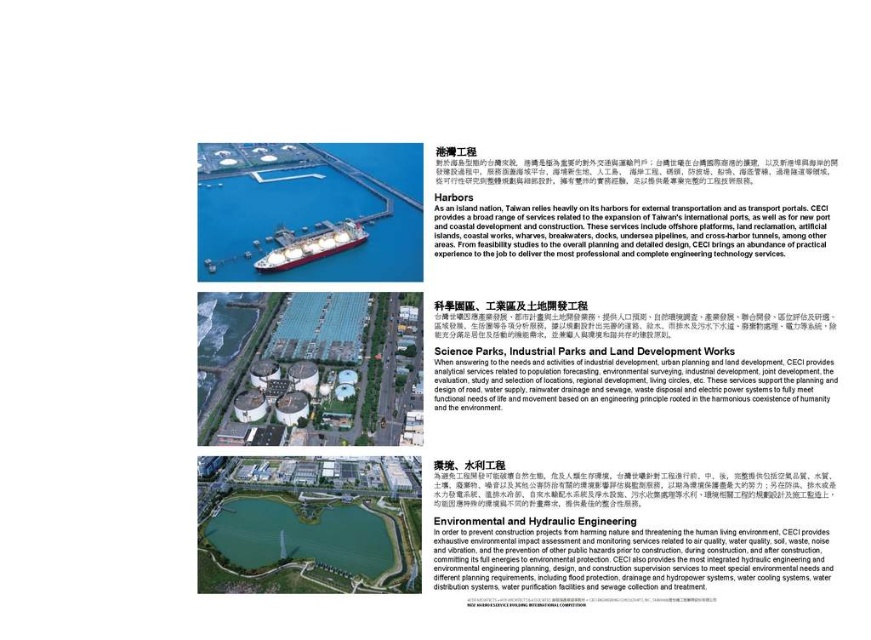
You are an engineer reviewing a project proposal. You see the white paper at center and the red glossy ship at center in the image. Which object is closer to you?

The white paper at center is closer to you because it is in front of the red glossy ship at center.

You are an engineer reviewing a document. The document has two elements on it, the white paper at center and the blue water at lower center. Which element takes up more area on the document?

The blue water at lower center takes up more area on the document because the white paper at center occupies less space than blue water at lower center.